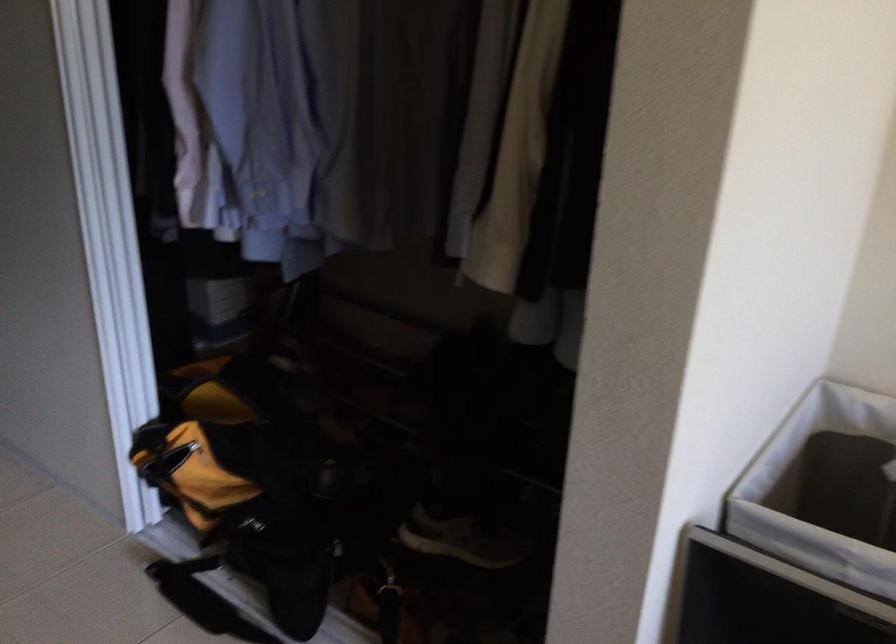
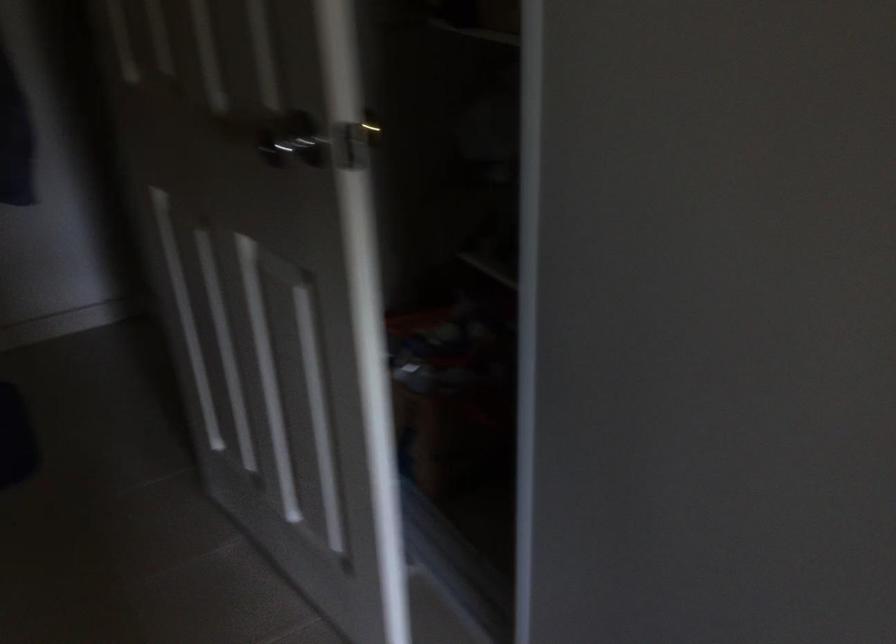
Which direction would the cameraman need to move to produce the second image?

The cameraman walked toward left, forward.